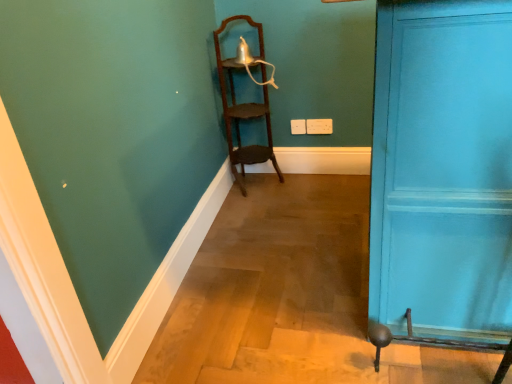
Identify the location of free spot below wooden shelf at center (from a real-world perspective). (260, 178).